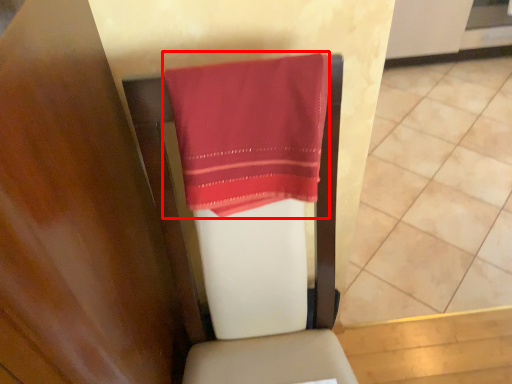
Question: From the image's perspective, where is towel (annotated by the red box) located relative to tile?

Choices:
 (A) below
 (B) above

Answer: (A)